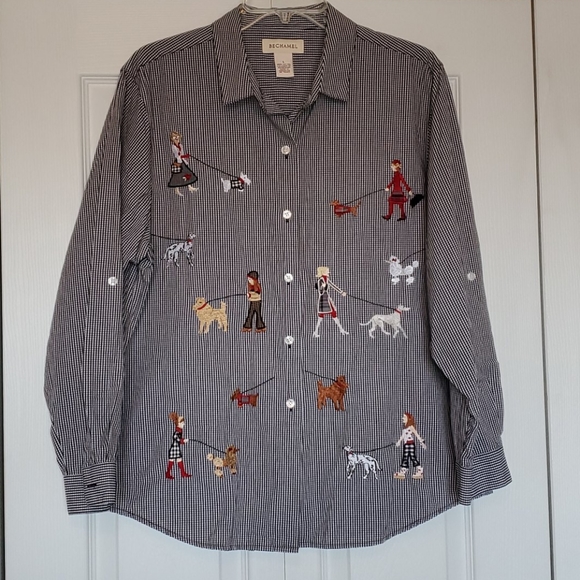
Where is `artwork top right`? artwork top right is located at coordinates (379, 192).